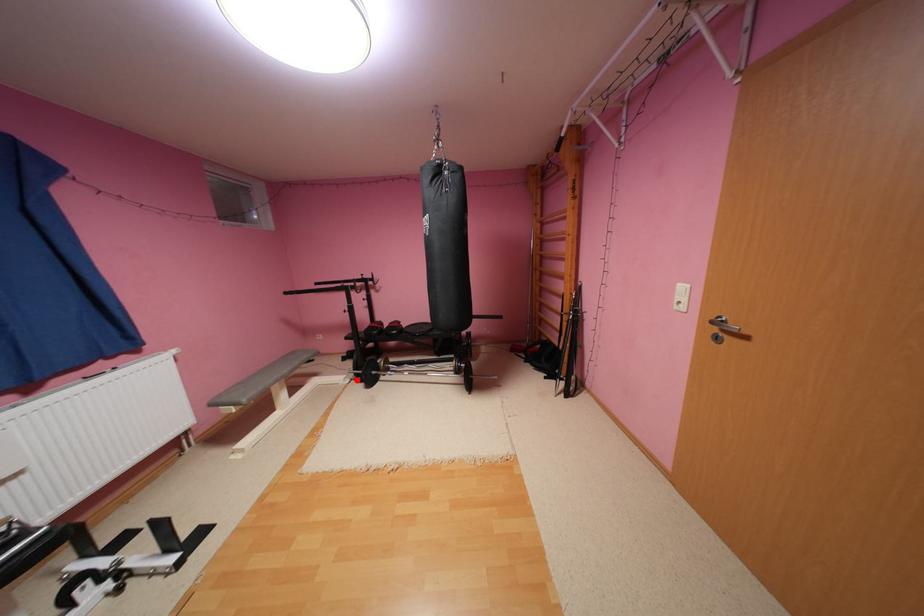
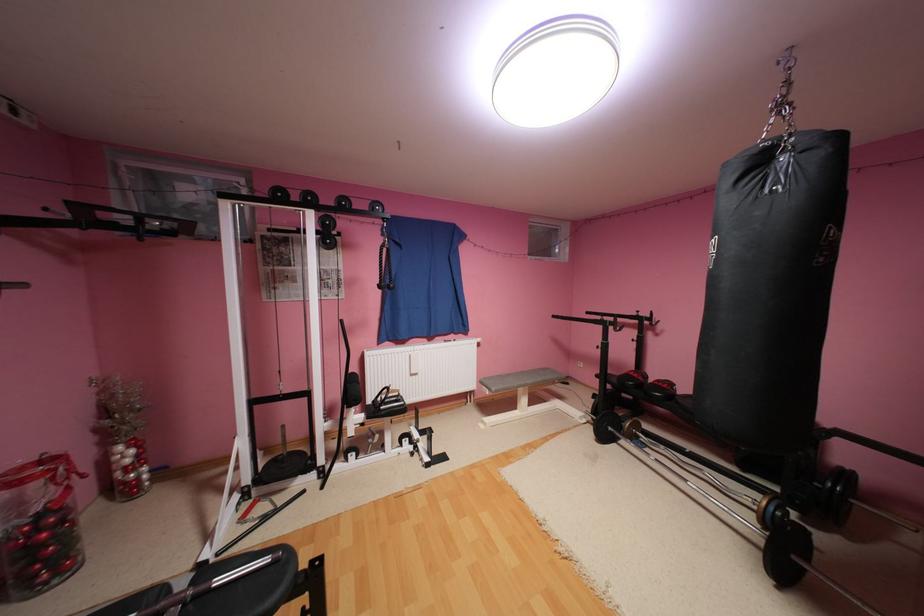
Locate, in the second image, the point that corresponds to the highlighted location in the first image.

(593, 419)